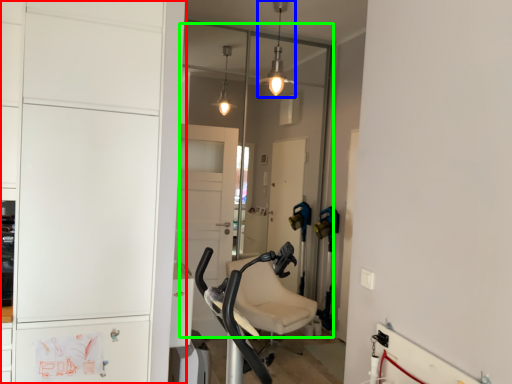
Question: Considering the real-world distances, which object is farthest from cabinetry (highlighted by a red box)? light fixture (highlighted by a blue box) or glass door (highlighted by a green box)?

Choices:
 (A) light fixture
 (B) glass door

Answer: (B)